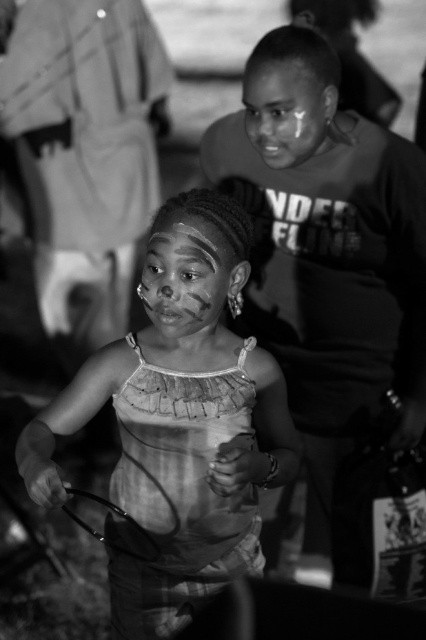
Based on the photo, what is the relationship between the positions of the smooth skin boy at center and the matte painted face at center in the image?

The smooth skin boy at center is located below the matte painted face at center.

You are an artist analyzing the composition of this black and white photo. You notice the matte fabric dress at center and the matte skin face at upper center. Which object is positioned lower in the image?

The matte fabric dress at center is positioned below the matte skin face at upper center, so the matte fabric dress at center is lower in the image.

What is the color of the dress worn by the person at the point labeled as point (178, 424)?

The dress worn by the person at point (178, 424) is matte fabric.